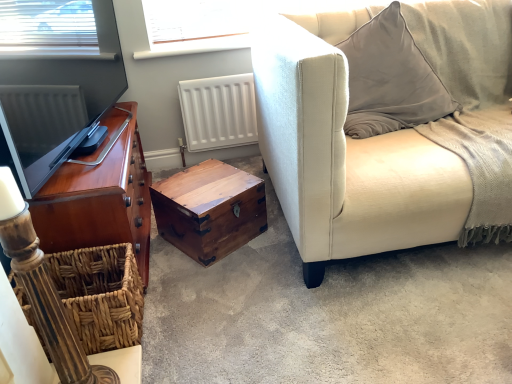
In order to click on free space in front of wooden chest at center in this screenshot , I will do `click(217, 276)`.